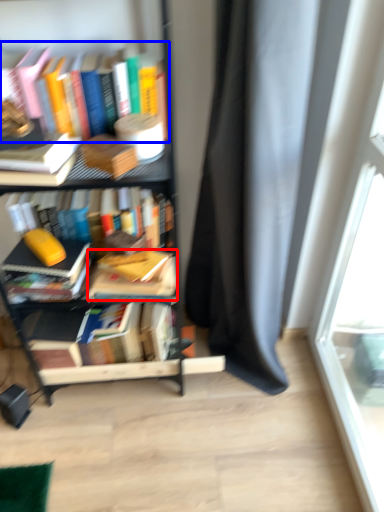
Question: Among these objects, which one is nearest to the camera, book (highlighted by a red box) or book (highlighted by a blue box)?

Choices:
 (A) book
 (B) book

Answer: (B)